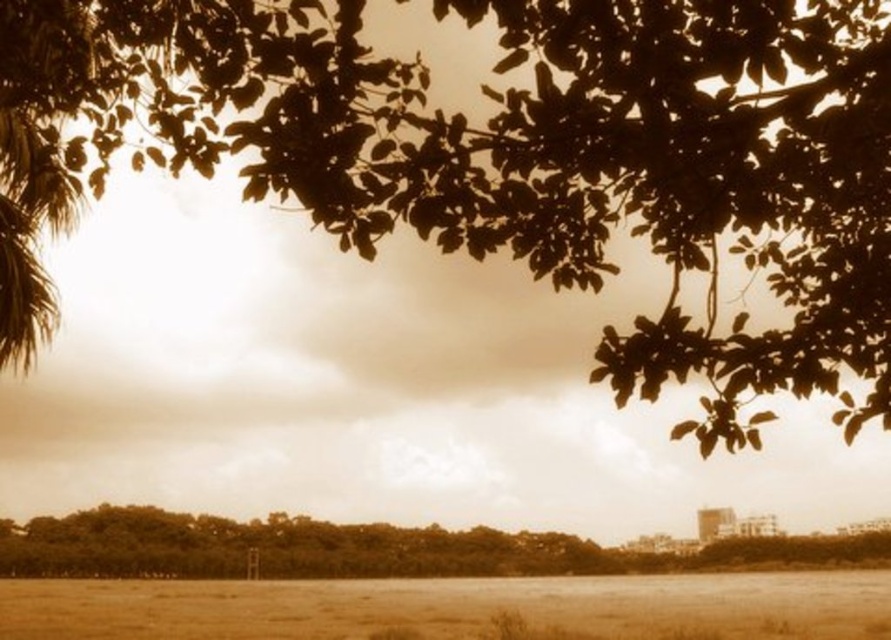
Does brown leafy branches at upper center have a lesser width compared to brown grass at lower center?

Yes, brown leafy branches at upper center is thinner than brown grass at lower center.

This screenshot has height=640, width=891. Identify the location of brown leafy branches at upper center. tap(505, 157).

Is brown leafy branches at upper center closer to camera compared to brown leafy tree at lower center?

That is True.

Which is above, brown leafy branches at upper center or brown leafy tree at lower center?

brown leafy branches at upper center

Measure the distance between brown leafy branches at upper center and camera.

brown leafy branches at upper center is 26.56 feet away from camera.

Find the location of a particular element. This screenshot has height=640, width=891. brown leafy branches at upper center is located at coordinates (505, 157).

Identify the location of brown grass at lower center. Image resolution: width=891 pixels, height=640 pixels. (455, 608).

Is brown grass at lower center below brown leafy tree at lower center?

Yes.

You are a GUI agent. You are given a task and a screenshot of the screen. Output one action in this format:
    pyautogui.click(x=<x>, y=<y>)
    Task: Click on the brown grass at lower center
    
    Given the screenshot: What is the action you would take?
    pyautogui.click(x=455, y=608)